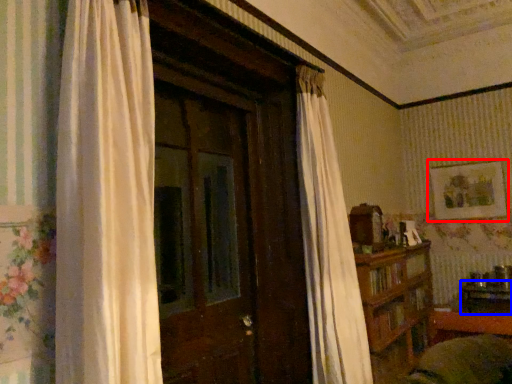
Question: Which point is closer to the camera, picture frame (highlighted by a red box) or table (highlighted by a blue box)?

Choices:
 (A) picture frame
 (B) table

Answer: (B)